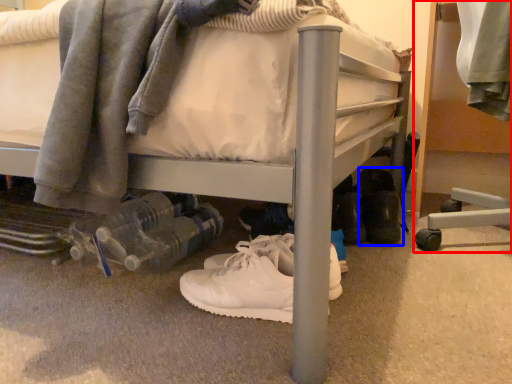
Question: Which point is closer to the camera, furniture (highlighted by a red box) or footwear (highlighted by a blue box)?

Choices:
 (A) furniture
 (B) footwear

Answer: (B)